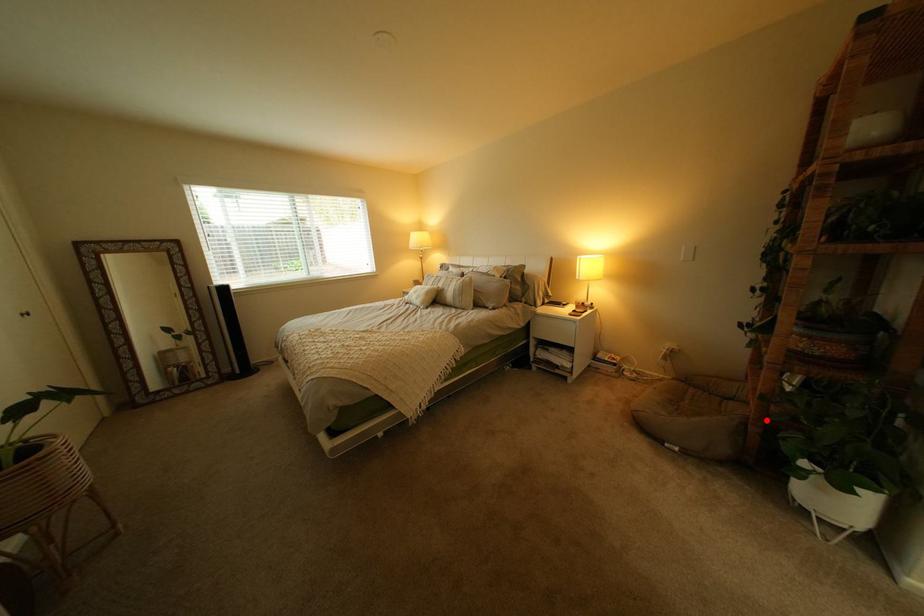
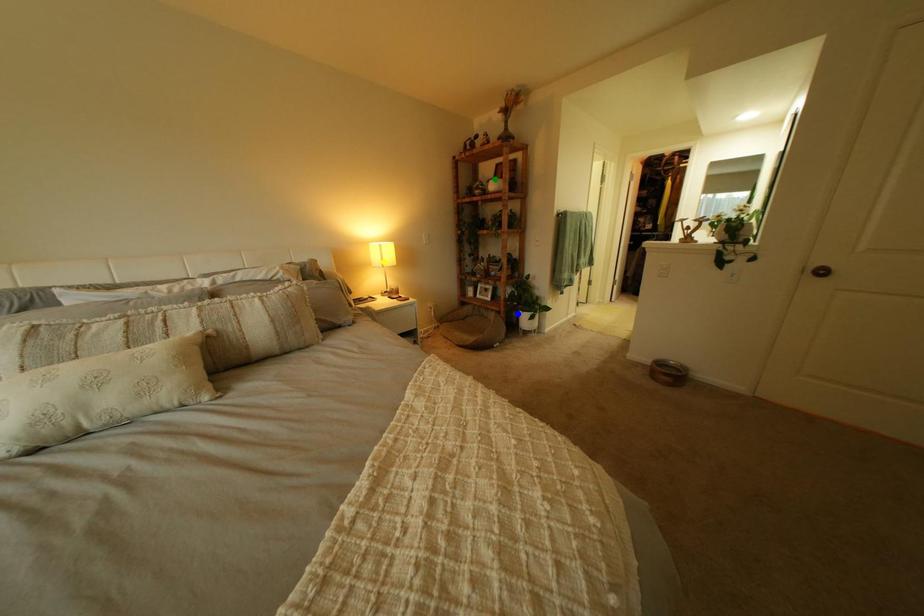
Question: I am providing you with two images of the same scene from different viewpoints. A red point is marked on the first image. You are given multiple points on the second image. Which mark in image 2 goes with the point in image 1?

Choices:
 (A) green point
 (B) yellow point
 (C) blue point

Answer: (C)